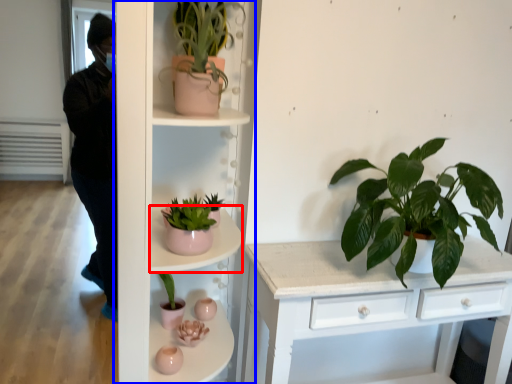
Question: Which point is closer to the camera, shelf (highlighted by a red box) or shelf (highlighted by a blue box)?

Choices:
 (A) shelf
 (B) shelf

Answer: (B)